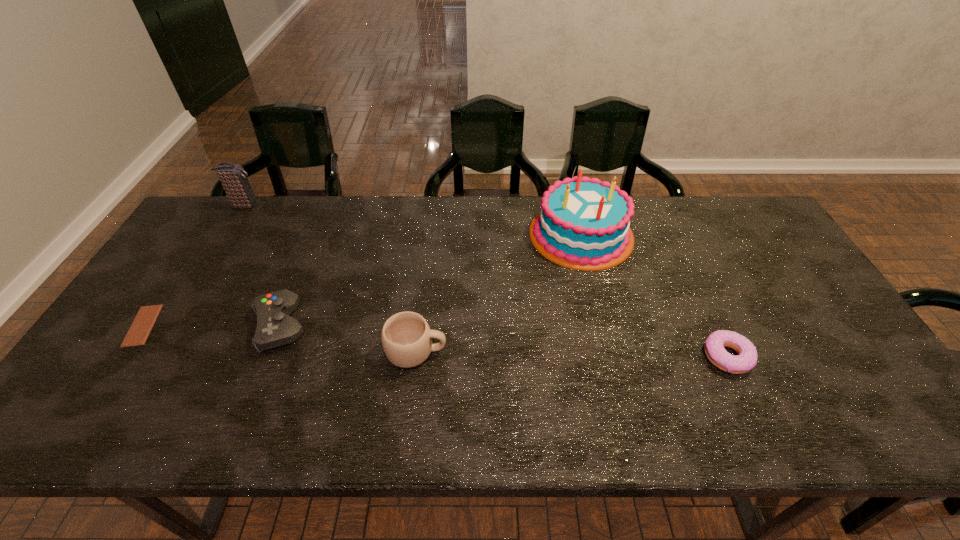
I want to click on vacant position in the image that satisfies the following two spatial constraints: 1. with the zip open on the third object from left to right; 2. on the left side of the clutch bag, so click(x=170, y=326).

At what (x,y) coordinates should I click in order to perform the action: click on vacant space that satisfies the following two spatial constraints: 1. with the zip open on the second tallest object; 2. on the right side of the tallest object. Please return your answer as a coordinate pair (x, y). The image size is (960, 540). Looking at the image, I should click on (227, 234).